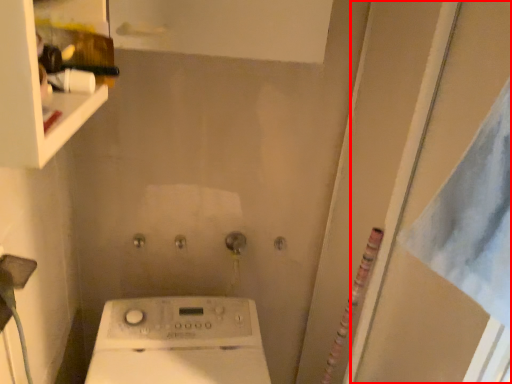
Question: From the image's perspective, what is the correct spatial positioning of screen door (annotated by the red box) in reference to shelf?

Choices:
 (A) below
 (B) above

Answer: (A)